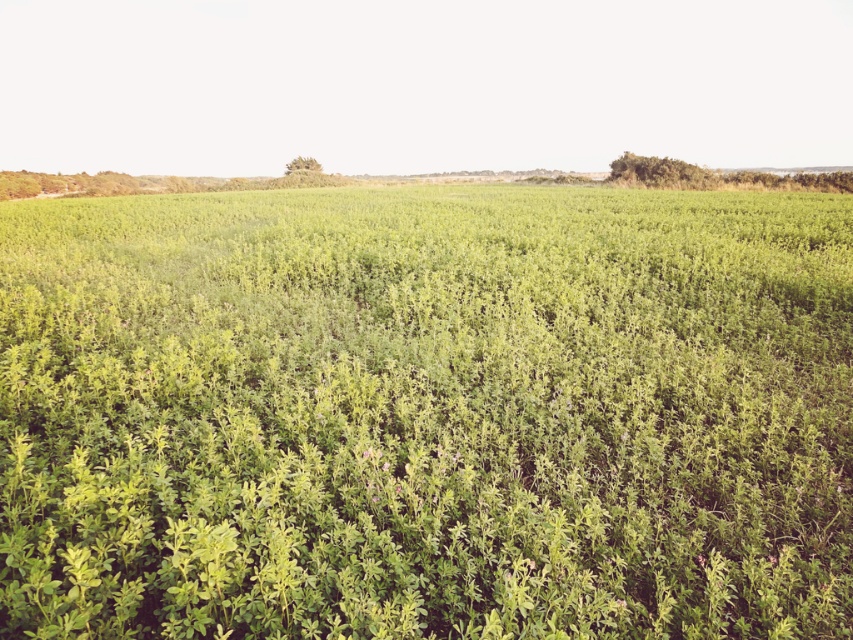
You are a gardener who wants to plant a new flower bed in the green leafy grass at center and green leafy bush at upper right. Which area has more space to accommodate larger plants?

The green leafy grass at center might be wider than green leafy bush at upper right, so it has more space to accommodate larger plants.

You are standing at the edge of the field and want to place a 8 feet long wooden board between the green leafy grass at center and another object. Is there enough space to place it without bending the board?

The distance between the green leafy grass at center and the other object is 7.99 feet. Since the board is 8 feet long, it is slightly longer than the available space. Therefore, the board cannot be placed straight without bending it.